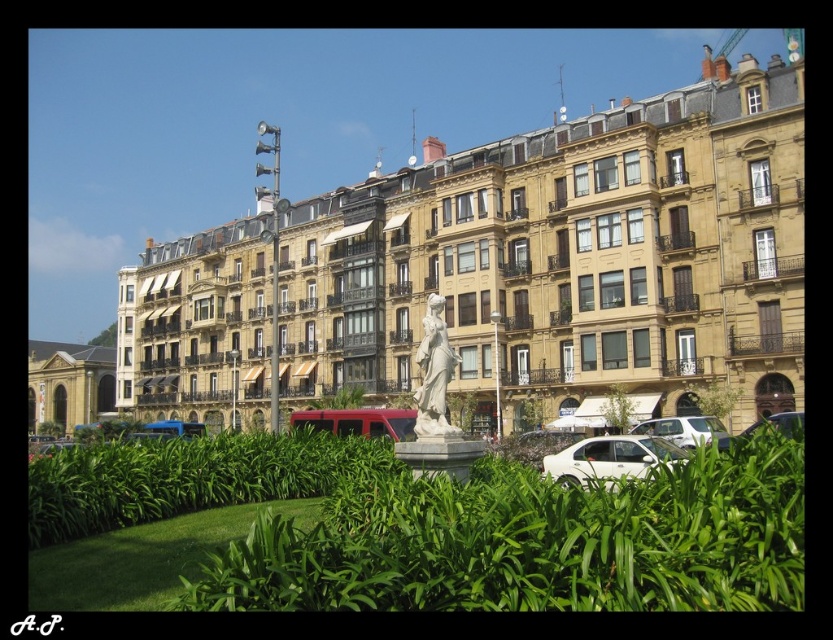
Is white matte car at lower right taller than white glossy car at center-right?

Indeed, white matte car at lower right has a greater height compared to white glossy car at center-right.

Does white matte car at lower right have a lesser height compared to white glossy car at center-right?

In fact, white matte car at lower right may be taller than white glossy car at center-right.

Describe the element at coordinates (609, 460) in the screenshot. This screenshot has height=640, width=833. I see `white matte car at lower right` at that location.

Locate an element on the screen. The image size is (833, 640). white matte car at lower right is located at coordinates (609, 460).

Does point (652, 550) lie behind point (352, 465)?

No, it is not.

Can you confirm if green leafy plants at center is smaller than green leafy shrubs at center?

Correct, green leafy plants at center occupies less space than green leafy shrubs at center.

Between point (697, 609) and point (78, 448), which one is positioned in front?

Positioned in front is point (697, 609).

The height and width of the screenshot is (640, 833). Find the location of `green leafy plants at center`. green leafy plants at center is located at coordinates (531, 541).

Is green leafy plants at center further to the viewer compared to metallic red van at center?

No, green leafy plants at center is closer to the viewer.

Which of these two, green leafy plants at center or metallic red van at center, stands shorter?

metallic red van at center is shorter.

Is point (527, 595) more distant than point (302, 422)?

No, (527, 595) is in front of (302, 422).

This screenshot has width=833, height=640. Identify the location of green leafy plants at center. (531, 541).